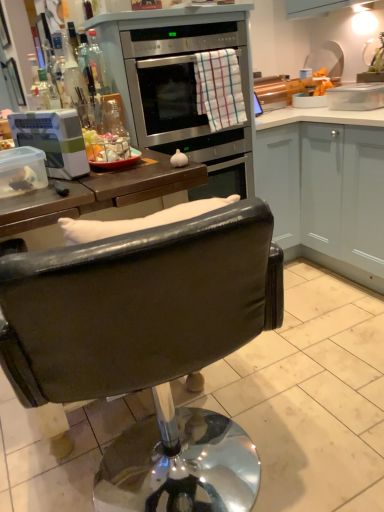
Question: Looking at their shapes, would you say clear glass bottle at upper left is wider or thinner than stainless steel oven at upper center?

Choices:
 (A) thin
 (B) wide

Answer: (A)

Question: Is point (92, 56) positioned closer to the camera than point (150, 139)?

Choices:
 (A) farther
 (B) closer

Answer: (B)

Question: Considering the real-world distances, which object is farthest from the black leather chair at center?

Choices:
 (A) stainless steel oven at upper center
 (B) metallic silver pot/pan at upper right
 (C) white plastic container at left
 (D) clear glass bottle at upper left
 (E) white matte cabinet at right

Answer: (B)

Question: Which is farther from the checkered cotton towel at center?

Choices:
 (A) black leather chair at center
 (B) white plastic container at left
 (C) stainless steel oven at upper center
 (D) clear glass bottle at upper left
 (E) metallic silver pot/pan at upper right

Answer: (A)